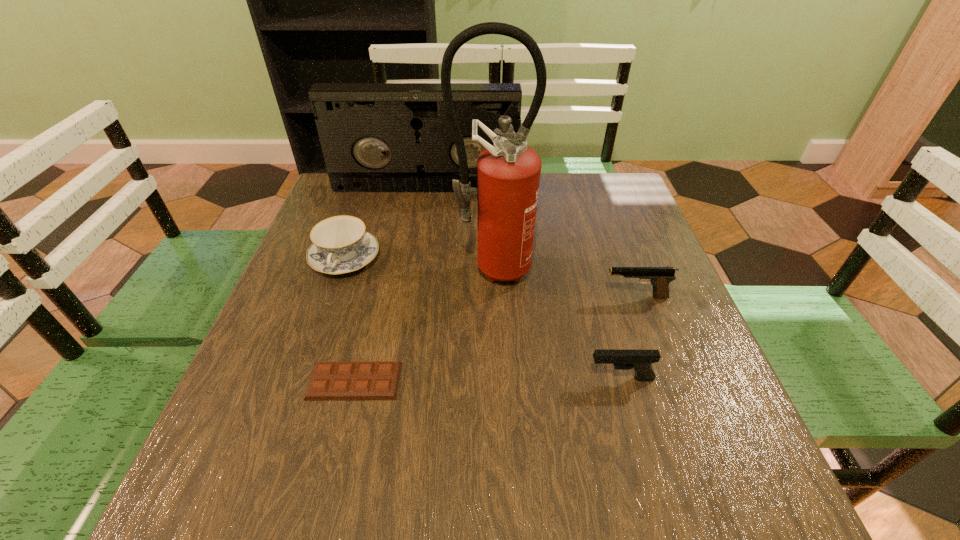
Locate an element on the screen. the tallest object is located at coordinates (508, 173).

Find the location of `the second tallest object`. the second tallest object is located at coordinates click(x=376, y=137).

Where is `videotape`? videotape is located at coordinates (376, 137).

At what (x,y) coordinates should I click in order to perform the action: click on the farther pistol. Please return your answer as a coordinate pair (x, y). Looking at the image, I should click on (660, 277).

This screenshot has width=960, height=540. I want to click on chinaware, so click(341, 245).

Locate an element on the screen. the nearer pistol is located at coordinates (640, 360).

Identify the location of the shortest object. The height and width of the screenshot is (540, 960). (330, 380).

At what (x,y) coordinates should I click in order to perform the action: click on vacant area situated at the nozzle of the fire extinguisher. Please return your answer as a coordinate pair (x, y). Image resolution: width=960 pixels, height=540 pixels. Looking at the image, I should click on (494, 393).

I want to click on vacant space positioned 0.240m on the front side of the farthest object, so click(416, 245).

You are a GUI agent. You are given a task and a screenshot of the screen. Output one action in this format:
    pyautogui.click(x=<x>, y=<y>)
    Task: Click on the vacant area situated at the muzzle of the third nearest object
    
    Given the screenshot: What is the action you would take?
    pyautogui.click(x=566, y=297)